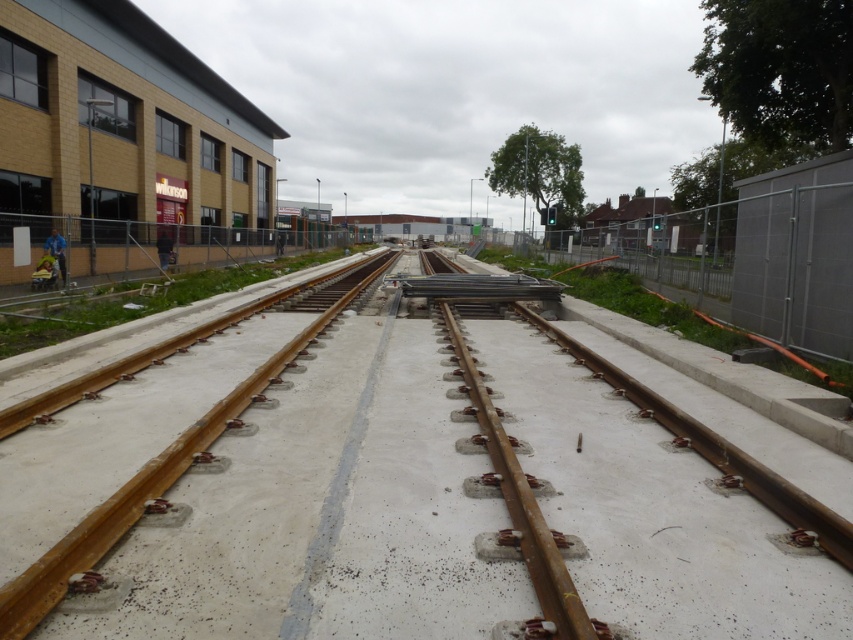
Is rusty metal train track at center closer to the viewer compared to rusty metal train track at left?

That is True.

Does rusty metal train track at center have a greater height compared to rusty metal train track at left?

Incorrect, rusty metal train track at center's height is not larger of rusty metal train track at left's.

Who is more distant from viewer, (291, 593) or (90, 573)?

The point (291, 593) is more distant.

You are a GUI agent. You are given a task and a screenshot of the screen. Output one action in this format:
    pyautogui.click(x=<x>, y=<y>)
    Task: Click on the rusty metal train track at center
    This screenshot has height=640, width=853.
    Given the screenshot: What is the action you would take?
    pyautogui.click(x=405, y=490)